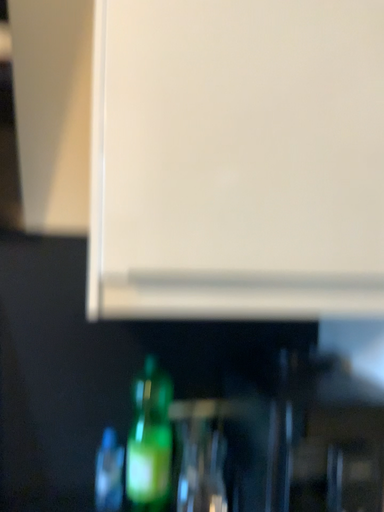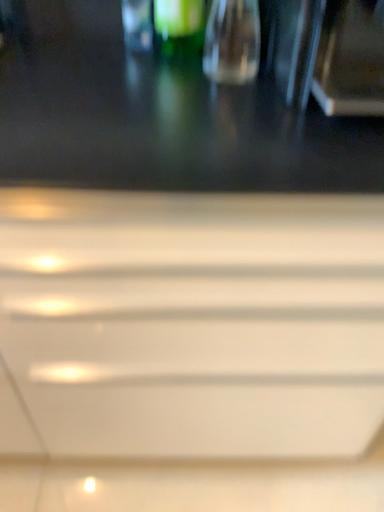
Question: How did the camera likely rotate when shooting the video?

Choices:
 (A) rotated upward
 (B) rotated downward

Answer: (B)